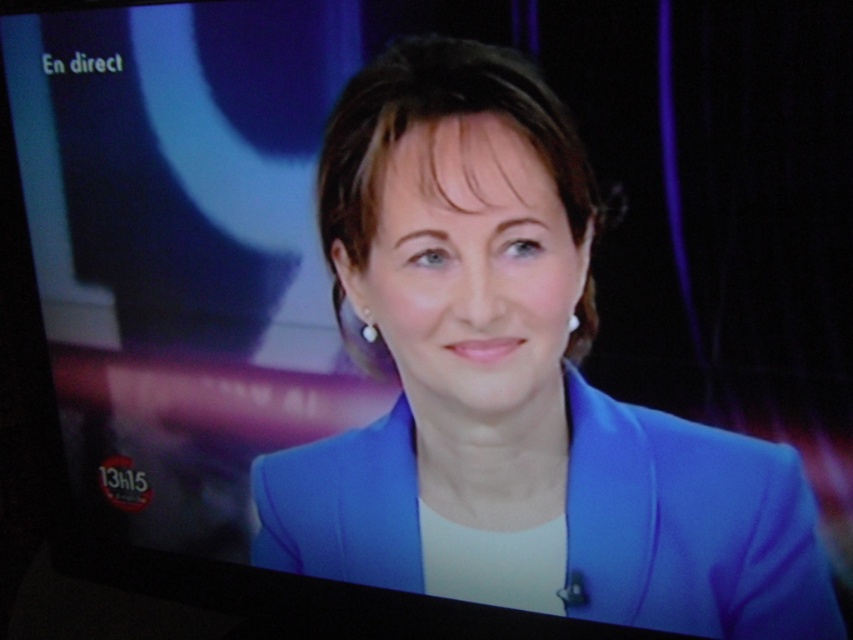
Is the position of blue fabric jacket at center more distant than that of blue smooth blazer at center?

No, it is not.

Which is behind, point (373, 163) or point (589, 506)?

The point (589, 506) is behind.

This screenshot has width=853, height=640. What are the coordinates of `blue fabric jacket at center` in the screenshot? It's located at (514, 387).